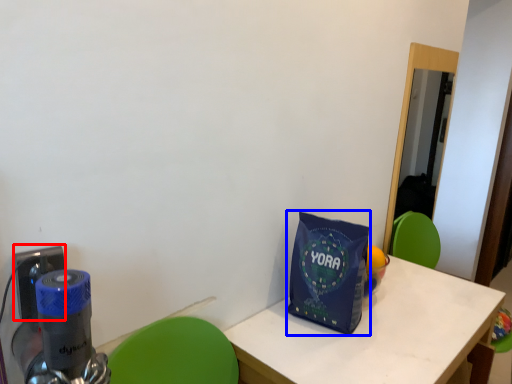
Question: Which point is closer to the camera, electric outlet (highlighted by a red box) or tote bag (highlighted by a blue box)?

Choices:
 (A) electric outlet
 (B) tote bag

Answer: (A)